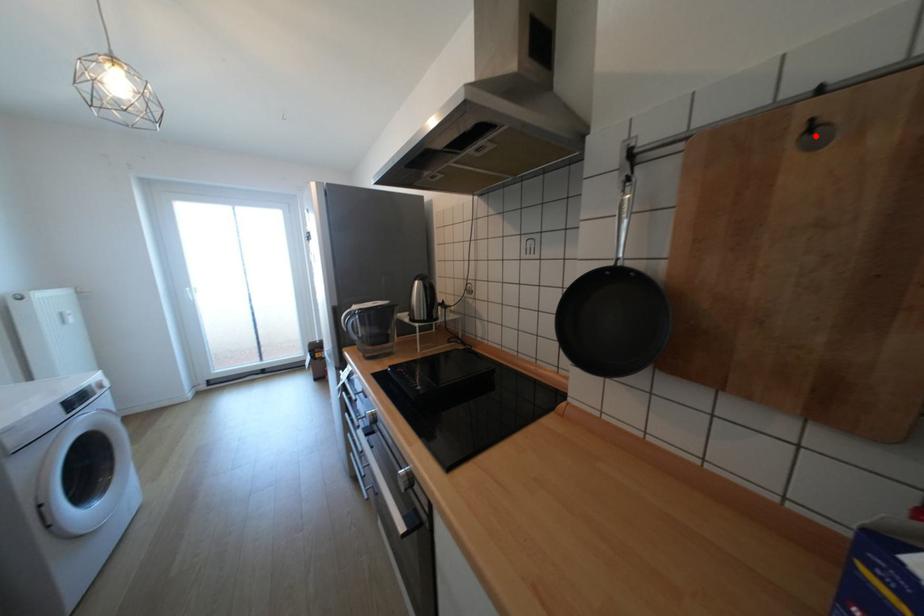
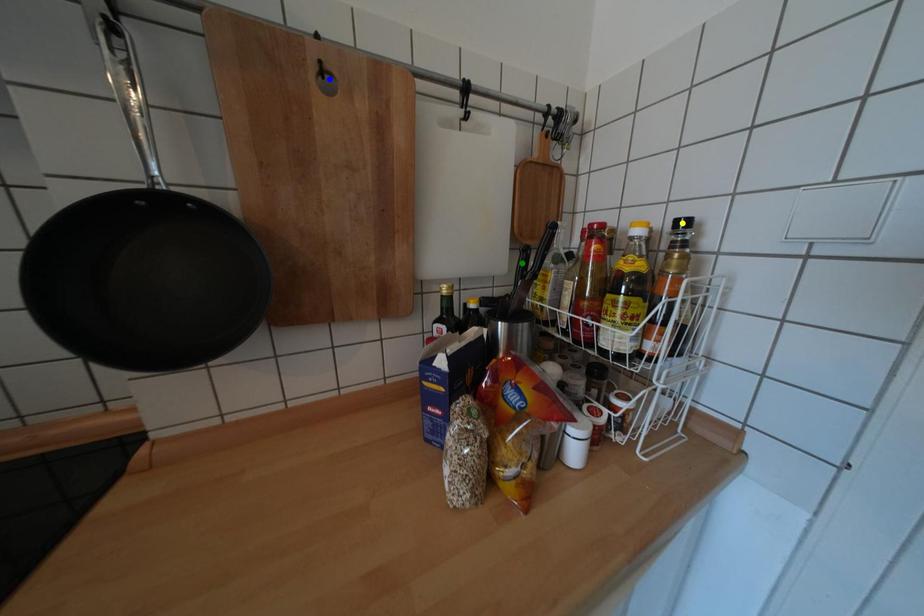
Question: I am providing you with two images of the same scene from different viewpoints. A red point is marked on the first image. You are given multiple points on the second image. Which mark in image 2 goes with the point in image 1?

Choices:
 (A) green point
 (B) yellow point
 (C) blue point

Answer: (C)